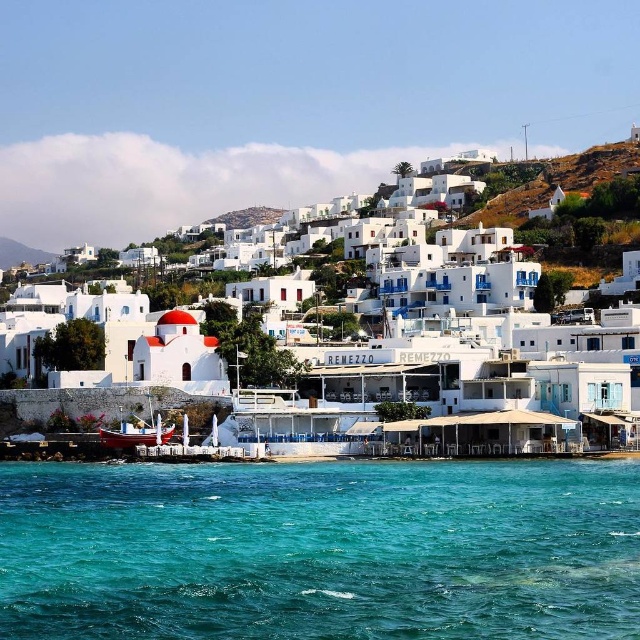
Question: Which of these objects is positioned farthest from the white matte building at center?

Choices:
 (A) wooden boat at lower left
 (B) turquoise liquid at lower center

Answer: (A)

Question: Which is nearer to the wooden boat at lower left?

Choices:
 (A) turquoise liquid at lower center
 (B) white matte building at center

Answer: (A)

Question: Can you confirm if white matte building at center is thinner than wooden boat at lower left?

Choices:
 (A) yes
 (B) no

Answer: (B)

Question: From the image, what is the correct spatial relationship of turquoise liquid at lower center in relation to white matte building at center?

Choices:
 (A) above
 (B) below

Answer: (B)

Question: Is turquoise liquid at lower center further to camera compared to white matte building at center?

Choices:
 (A) no
 (B) yes

Answer: (A)

Question: Among these objects, which one is nearest to the camera?

Choices:
 (A) white matte building at center
 (B) turquoise liquid at lower center

Answer: (B)